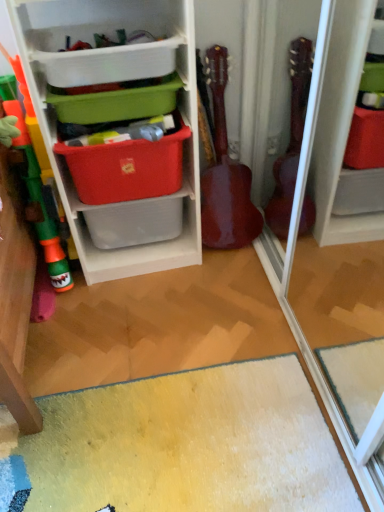
Question: Can you confirm if glossy wood guitar at center is taller than matte plastic storage box at upper center, the 2th storage box from the bottom?

Choices:
 (A) no
 (B) yes

Answer: (B)

Question: From a real-world perspective, is glossy wood guitar at center positioned under matte plastic storage box at upper center, which is the 2th storage box in top-to-bottom order, based on gravity?

Choices:
 (A) yes
 (B) no

Answer: (A)

Question: Is glossy wood guitar at center oriented away from matte plastic storage box at upper center, the 2th storage box from the bottom?

Choices:
 (A) no
 (B) yes

Answer: (A)

Question: From a real-world perspective, is glossy wood guitar at center on matte plastic storage box at upper center, which is the 2th storage box in top-to-bottom order?

Choices:
 (A) no
 (B) yes

Answer: (A)

Question: Can you confirm if glossy wood guitar at center is thinner than matte plastic storage box at upper center, which is the 2th storage box in top-to-bottom order?

Choices:
 (A) no
 (B) yes

Answer: (B)

Question: Are glossy wood guitar at center and matte plastic storage box at upper center, the 2th storage box from the bottom, beside each other?

Choices:
 (A) yes
 (B) no

Answer: (B)

Question: Can you confirm if green plastic storage box at upper center, which ranks as the third storage box in bottom-to-top order, is taller than matte plastic storage box at upper center, which is the 2th storage box in top-to-bottom order?

Choices:
 (A) no
 (B) yes

Answer: (B)

Question: Is green plastic storage box at upper center, the 1th storage box positioned from the top, shorter than matte plastic storage box at upper center, which is the 2th storage box in top-to-bottom order?

Choices:
 (A) yes
 (B) no

Answer: (B)

Question: Is green plastic storage box at upper center, the 1th storage box positioned from the top, aimed at matte plastic storage box at upper center, the 2th storage box from the bottom?

Choices:
 (A) no
 (B) yes

Answer: (A)

Question: Is green plastic storage box at upper center, the 1th storage box positioned from the top, positioned behind matte plastic storage box at upper center, which is the 2th storage box in top-to-bottom order?

Choices:
 (A) yes
 (B) no

Answer: (B)

Question: From the image's perspective, is green plastic storage box at upper center, the 1th storage box positioned from the top, on top of matte plastic storage box at upper center, the 2th storage box from the bottom?

Choices:
 (A) no
 (B) yes

Answer: (B)

Question: Is green plastic storage box at upper center, the 1th storage box positioned from the top, to the left of matte plastic storage box at upper center, which is the 2th storage box in top-to-bottom order, from the viewer's perspective?

Choices:
 (A) no
 (B) yes

Answer: (B)

Question: From a real-world perspective, is green plastic storage box at upper center, which ranks as the third storage box in bottom-to-top order, positioned under red fabric storage box at center, which is the 3th storage box from top to bottom, based on gravity?

Choices:
 (A) no
 (B) yes

Answer: (A)